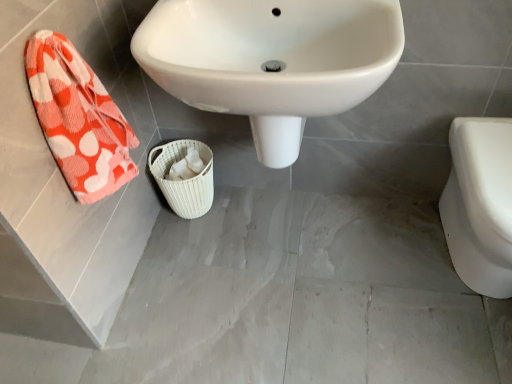
Describe the element at coordinates (78, 118) in the screenshot. This screenshot has width=512, height=384. I see `orange-patterned towel at left` at that location.

Locate an element on the screen. white woven basket at center is located at coordinates (185, 179).

Where is `orange-patterned towel at left`? This screenshot has height=384, width=512. orange-patterned towel at left is located at coordinates (78, 118).

From a real-world perspective, is white glossy toilet at right on white woven basket at center?

Yes, from a real-world perspective, white glossy toilet at right is on top of white woven basket at center.

Which of these two, white glossy toilet at right or white woven basket at center, stands shorter?

white woven basket at center.

Does white glossy toilet at right have a greater width compared to white woven basket at center?

Correct, the width of white glossy toilet at right exceeds that of white woven basket at center.

Does white glossy toilet at right have a smaller size compared to white woven basket at center?

No, white glossy toilet at right is not smaller than white woven basket at center.

Is orange-patterned towel at left not near white woven basket at center?

No, orange-patterned towel at left is not far away from white woven basket at center.

From the picture: Is orange-patterned towel at left at the right side of white woven basket at center?

In fact, orange-patterned towel at left is to the left of white woven basket at center.

Consider the image. Can you confirm if orange-patterned towel at left is wider than white woven basket at center?

Yes, orange-patterned towel at left is wider than white woven basket at center.

Based on their sizes in the image, would you say orange-patterned towel at left is bigger or smaller than white glossy sink at center?

Considering their sizes, orange-patterned towel at left takes up less space than white glossy sink at center.

Is orange-patterned towel at left wider or thinner than white glossy sink at center?

Considering their sizes, orange-patterned towel at left looks slimmer than white glossy sink at center.

Considering the positions of objects orange-patterned towel at left and white glossy sink at center in the image provided, who is behind, orange-patterned towel at left or white glossy sink at center?

orange-patterned towel at left is further from the camera.

Considering the sizes of orange-patterned towel at left and white glossy sink at center in the image, is orange-patterned towel at left taller or shorter than white glossy sink at center?

In the image, orange-patterned towel at left appears to be shorter than white glossy sink at center.

Is white glossy sink at center oriented away from white woven basket at center?

No, white glossy sink at center's orientation is not away from white woven basket at center.

Is white glossy sink at center located outside white woven basket at center?

Yes, white glossy sink at center is located beyond the bounds of white woven basket at center.

Which is closer to the camera, (213, 79) or (203, 189)?

Positioned in front is point (213, 79).

Considering their positions, is white glossy sink at center located in front of or behind white woven basket at center?

Clearly, white glossy sink at center is in front of white woven basket at center.

Does white glossy toilet at right have a smaller size compared to white glossy sink at center?

Yes.

Which object is closer to the camera taking this photo, white glossy toilet at right or white glossy sink at center?

white glossy sink at center.

Is white glossy toilet at right next to white glossy sink at center?

No, white glossy toilet at right is not with white glossy sink at center.

Which object is positioned more to the left, white glossy sink at center or orange-patterned towel at left?

orange-patterned towel at left.

From a real-world perspective, which object stands above the other?

orange-patterned towel at left is physically above.

How many degrees apart are the facing directions of white glossy sink at center and orange-patterned towel at left?

The angular difference between white glossy sink at center and orange-patterned towel at left is 1.37 degrees.

From the image's perspective, is white glossy sink at center over orange-patterned towel at left?

Yes, from the image's perspective, white glossy sink at center is over orange-patterned towel at left.

Is white woven basket at center positioned with its back to white glossy sink at center?

white woven basket at center is not turned away from white glossy sink at center.

Could white glossy sink at center be considered to be inside white woven basket at center?

No, white glossy sink at center is not surrounded by white woven basket at center.

Considering the relative sizes of white woven basket at center and white glossy sink at center in the image provided, is white woven basket at center thinner than white glossy sink at center?

Indeed, white woven basket at center has a lesser width compared to white glossy sink at center.

Locate an element on the screen. basket lying above the white glossy toilet at right (from the image's perspective) is located at coordinates (185, 179).

Where is `beach towel in front of the white woven basket at center`? beach towel in front of the white woven basket at center is located at coordinates click(78, 118).

Looking at the image, which one is located closer to white glossy sink at center, white glossy toilet at right or white woven basket at center?

Among the two, white woven basket at center is located nearer to white glossy sink at center.

From the image, which object appears to be farther from white woven basket at center, orange-patterned towel at left or white glossy toilet at right?

Among the two, white glossy toilet at right is located further to white woven basket at center.

When comparing their distances from white glossy toilet at right, does white woven basket at center or white glossy sink at center seem closer?

Based on the image, white glossy sink at center appears to be nearer to white glossy toilet at right.

Which object lies further to the anchor point white glossy toilet at right, white glossy sink at center or white woven basket at center?

white woven basket at center.

Looking at the image, which one is located closer to white glossy sink at center, orange-patterned towel at left or white woven basket at center?

The object closer to white glossy sink at center is orange-patterned towel at left.

Looking at the image, which one is located closer to white glossy toilet at right, white woven basket at center or orange-patterned towel at left?

The object closer to white glossy toilet at right is white woven basket at center.

Considering their positions, is white glossy toilet at right positioned further to orange-patterned towel at left than white glossy sink at center?

white glossy toilet at right.

Considering their positions, is white glossy sink at center positioned closer to orange-patterned towel at left than white glossy toilet at right?

Based on the image, white glossy sink at center appears to be nearer to orange-patterned towel at left.

The width and height of the screenshot is (512, 384). Find the location of `sink situated between orange-patterned towel at left and white glossy toilet at right from left to right`. sink situated between orange-patterned towel at left and white glossy toilet at right from left to right is located at coordinates (271, 60).

This screenshot has height=384, width=512. I want to click on beach towel between white glossy sink at center and white woven basket at center in the front-back direction, so click(x=78, y=118).

The width and height of the screenshot is (512, 384). I want to click on basket between orange-patterned towel at left and white glossy toilet at right in the horizontal direction, so click(185, 179).

Where is `sink between white woven basket at center and white glossy toilet at right from left to right`? Image resolution: width=512 pixels, height=384 pixels. sink between white woven basket at center and white glossy toilet at right from left to right is located at coordinates (271, 60).